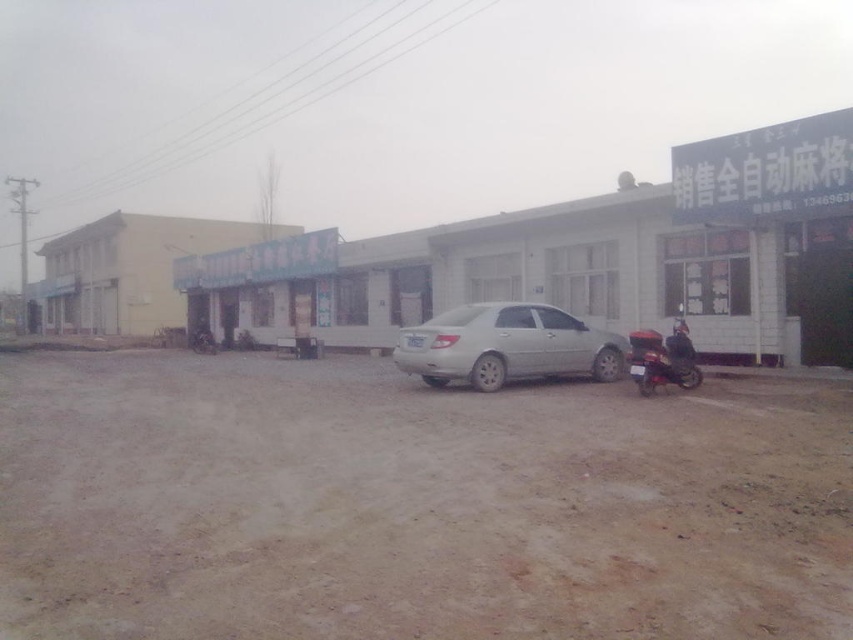
Question: Is silver metallic car at center closer to the viewer compared to metallic red scooter at right?

Choices:
 (A) yes
 (B) no

Answer: (B)

Question: Does brown sandy dirt track at lower center appear on the right side of silver metallic car at center?

Choices:
 (A) yes
 (B) no

Answer: (B)

Question: Among these points, which one is nearest to the camera?

Choices:
 (A) (460, 330)
 (B) (643, 332)

Answer: (B)

Question: Is silver metallic car at center in front of metallic red scooter at right?

Choices:
 (A) yes
 (B) no

Answer: (B)

Question: Which object appears farthest from the camera in this image?

Choices:
 (A) metallic red scooter at right
 (B) brown sandy dirt track at lower center
 (C) silver metallic car at center

Answer: (C)

Question: Among these points, which one is farthest from the camera?

Choices:
 (A) (722, 588)
 (B) (656, 381)
 (C) (534, 308)

Answer: (C)